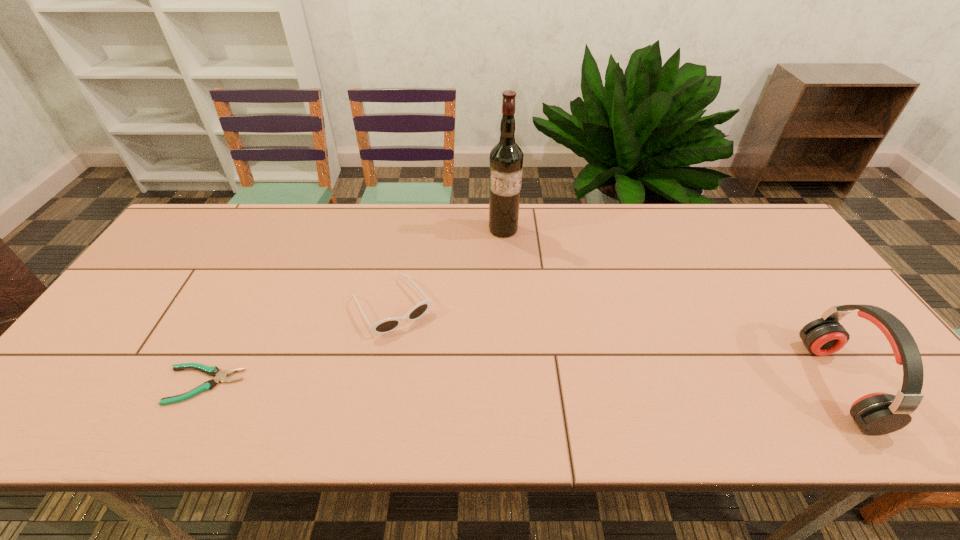
At what (x,y) coordinates should I click in order to perform the action: click on free spot between the pliers and the third shortest object. Please return your answer as a coordinate pair (x, y). The width and height of the screenshot is (960, 540). Looking at the image, I should click on (520, 384).

This screenshot has width=960, height=540. In order to click on free space between the leftmost object and the second farthest object in this screenshot , I will do `click(298, 346)`.

Where is `unoccupied position between the third tallest object and the pliers`? unoccupied position between the third tallest object and the pliers is located at coordinates (298, 346).

Identify the location of vacant space that is in between the third shortest object and the second object from right to left. (671, 307).

The height and width of the screenshot is (540, 960). Find the location of `free space that is in between the earphone and the third tallest object`. free space that is in between the earphone and the third tallest object is located at coordinates (615, 345).

Image resolution: width=960 pixels, height=540 pixels. What are the coordinates of `unoccupied position between the third object from right to left and the pliers` in the screenshot? It's located at (298, 346).

I want to click on free space between the shortest object and the earphone, so pos(520,384).

Image resolution: width=960 pixels, height=540 pixels. Find the location of `free area in between the third tallest object and the third object from left to right`. free area in between the third tallest object and the third object from left to right is located at coordinates (447, 268).

Find the location of a particular element. The width and height of the screenshot is (960, 540). object that ranks as the third closest to the farthest object is located at coordinates (879, 413).

You are a GUI agent. You are given a task and a screenshot of the screen. Output one action in this format:
    pyautogui.click(x=<x>, y=<y>)
    Task: Click on the object that is the closest one to the shortest object
    
    Given the screenshot: What is the action you would take?
    pyautogui.click(x=385, y=326)